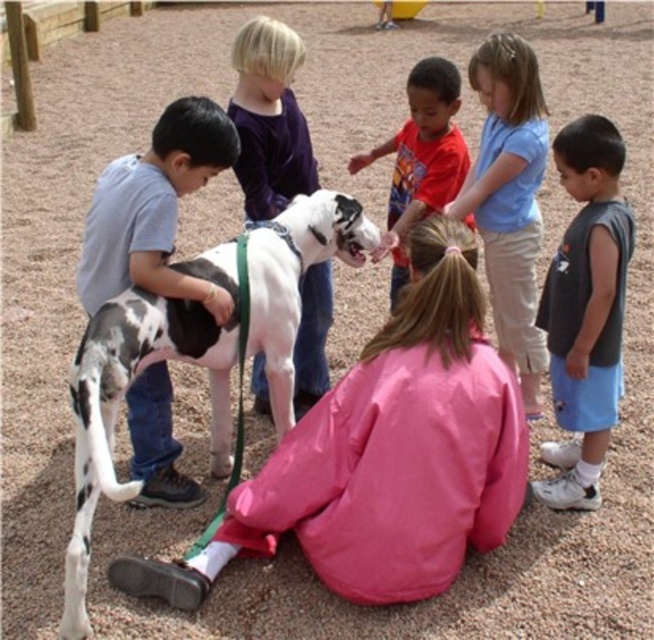
Question: Which object is positioned closest to the light blue cotton shirt at upper center?

Choices:
 (A) spotted fur dog at center
 (B) smooth purple shirt at upper center
 (C) gray sleeveless shirt at right

Answer: (C)

Question: Can you confirm if spotted fur dog at center is positioned below spotted fur dalmatian at left?

Choices:
 (A) yes
 (B) no

Answer: (A)

Question: Can you confirm if spotted fur dog at center is wider than light blue cotton shirt at upper center?

Choices:
 (A) yes
 (B) no

Answer: (A)

Question: Which object is farther from the camera taking this photo?

Choices:
 (A) red cotton shirt at center
 (B) smooth purple shirt at upper center

Answer: (A)

Question: Which point is closer to the camera taking this photo?

Choices:
 (A) (250, 336)
 (B) (519, 147)

Answer: (A)

Question: Can you confirm if spotted fur dalmatian at left is smaller than gray sleeveless shirt at right?

Choices:
 (A) no
 (B) yes

Answer: (B)